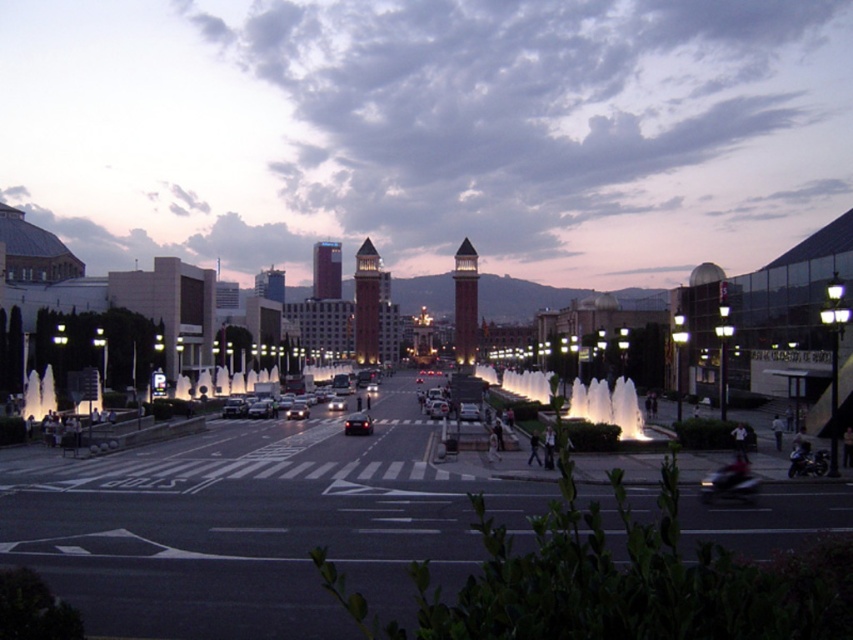
Question: Which point is farther from the camera taking this photo?

Choices:
 (A) (306, 412)
 (B) (218, 451)

Answer: (A)

Question: Among these points, which one is farthest from the camera?

Choices:
 (A) (370, 358)
 (B) (303, 410)
 (C) (318, 284)

Answer: (C)

Question: Is black asphalt road at center in front of shiny silver sedan at center?

Choices:
 (A) no
 (B) yes

Answer: (B)

Question: Can you confirm if matte brick towers at center is positioned below black asphalt road at center?

Choices:
 (A) yes
 (B) no

Answer: (B)

Question: Estimate the real-world distances between objects in this image. Which object is farther from the brick stone bell tower at center?

Choices:
 (A) matte brick tower at center
 (B) matte brick towers at center
 (C) illuminated stone fountain at center
 (D) brown brick bell tower at center

Answer: (B)

Question: Is illuminated stone fountain at center closer to the viewer compared to brown brick bell tower at center?

Choices:
 (A) no
 (B) yes

Answer: (B)